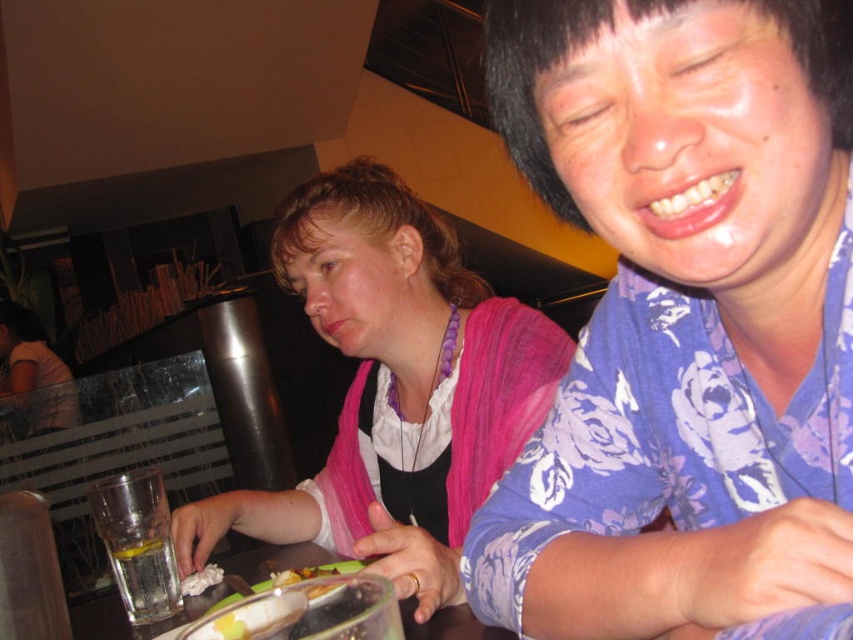
Is point (248, 560) positioned in front of point (123, 595)?

No.

Between clear glass table at center and clear glass water at lower left, which one is positioned lower?

clear glass table at center

I want to click on clear glass table at center, so click(125, 616).

How far apart are blue floral shirt at center and shiny plastic fork at lower center?

They are 13.62 inches apart.

Can you confirm if blue floral shirt at center is shorter than shiny plastic fork at lower center?

No, blue floral shirt at center is not shorter than shiny plastic fork at lower center.

Is point (827, 387) positioned before point (293, 573)?

Yes, it is in front of point (293, 573).

You are a GUI agent. You are given a task and a screenshot of the screen. Output one action in this format:
    pyautogui.click(x=<x>, y=<y>)
    Task: Click on the blue floral shirt at center
    The image size is (853, 640).
    Given the screenshot: What is the action you would take?
    pyautogui.click(x=683, y=323)

Does pink fabric scarf at center appear under translucent glass at lower left?

Incorrect, pink fabric scarf at center is not positioned below translucent glass at lower left.

Who is positioned more to the right, pink fabric scarf at center or translucent glass at lower left?

Positioned to the right is pink fabric scarf at center.

Does point (480, 484) come in front of point (207, 580)?

No, it is behind (207, 580).

At what (x,y) coordinates should I click in order to perform the action: click on pink fabric scarf at center. Please return your answer as a coordinate pair (x, y). This screenshot has height=640, width=853. Looking at the image, I should click on (395, 387).